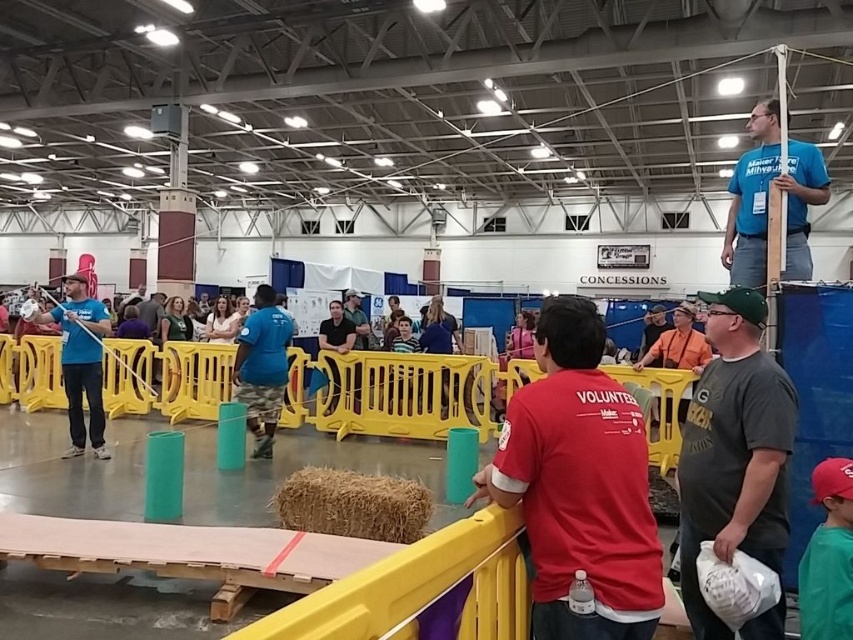
You are standing at the entrance of the hall and see two points marked on the floor. The first point is at coordinates point (334, 492) and the second point is at point (97, 378). Which point is closer to you?

Point (334, 492) is in front of point (97, 378), so the first point is closer to you.

You are a volunteer at the event and need to deliver a package from the brown straw bale at center to the matte blue shirt at left. Can you walk directly between them without needing to go around any obstacles?

The distance between the brown straw bale at center and the matte blue shirt at left is 3.54 meters, so yes, you can walk directly between them as there are no obstacles mentioned in the scene description.